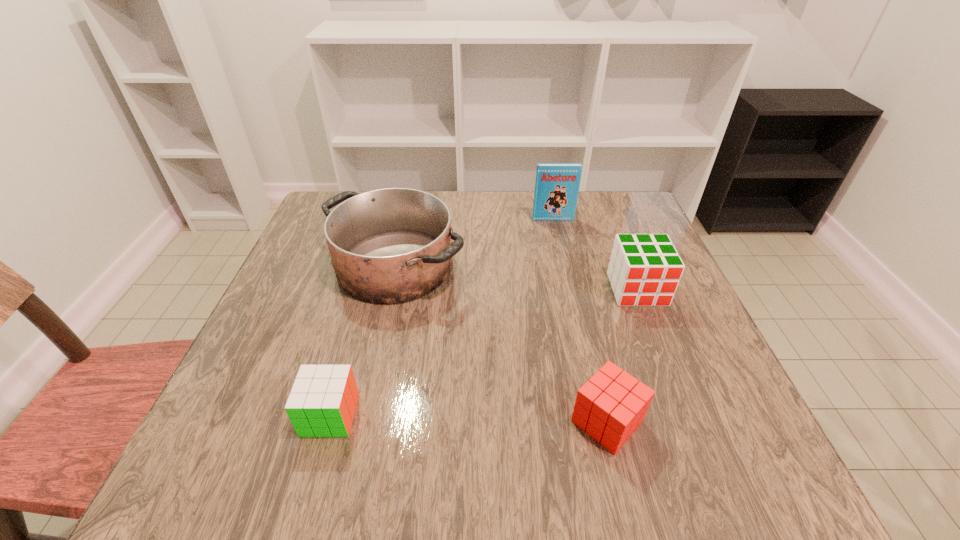
You are a GUI agent. You are given a task and a screenshot of the screen. Output one action in this format:
    pyautogui.click(x=<x>, y=<y>)
    Task: Click on the farthest object
    The image size is (960, 540).
    Given the screenshot: What is the action you would take?
    pyautogui.click(x=557, y=185)

This screenshot has width=960, height=540. Find the location of `the tallest object`. the tallest object is located at coordinates (557, 185).

Identify the location of saucepan. The width and height of the screenshot is (960, 540). (392, 245).

Find the location of `the tallest cube`. the tallest cube is located at coordinates (644, 270).

Locate an element on the screen. Image resolution: width=960 pixels, height=540 pixels. the farthest cube is located at coordinates (644, 270).

What are the coordinates of `the second cube from left to right` in the screenshot? It's located at 610,406.

I want to click on the leftmost cube, so click(322, 403).

Where is `vacant space located on the front cover of the book`? Image resolution: width=960 pixels, height=540 pixels. vacant space located on the front cover of the book is located at coordinates (572, 306).

The height and width of the screenshot is (540, 960). I want to click on free spot located on the right of the saucepan, so click(516, 265).

Locate an element on the screen. The image size is (960, 540). vacant space located 0.120m on the red face of the farthest cube is located at coordinates (661, 350).